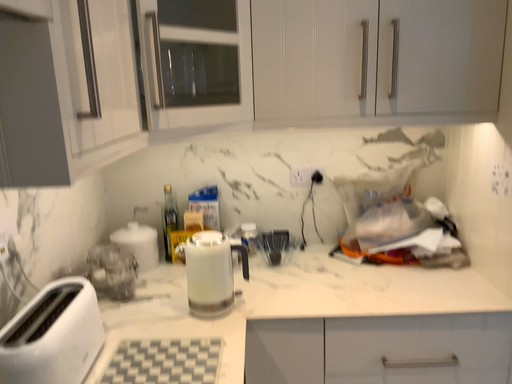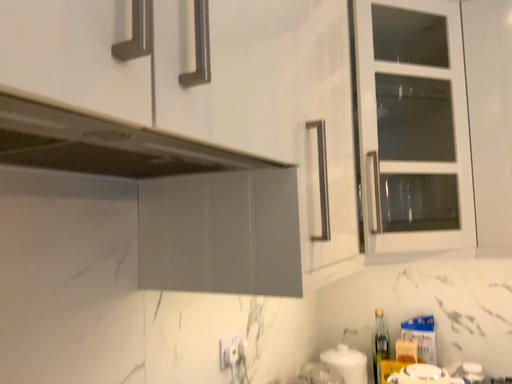
Question: How did the camera likely rotate when shooting the video?

Choices:
 (A) rotated right
 (B) rotated left

Answer: (B)